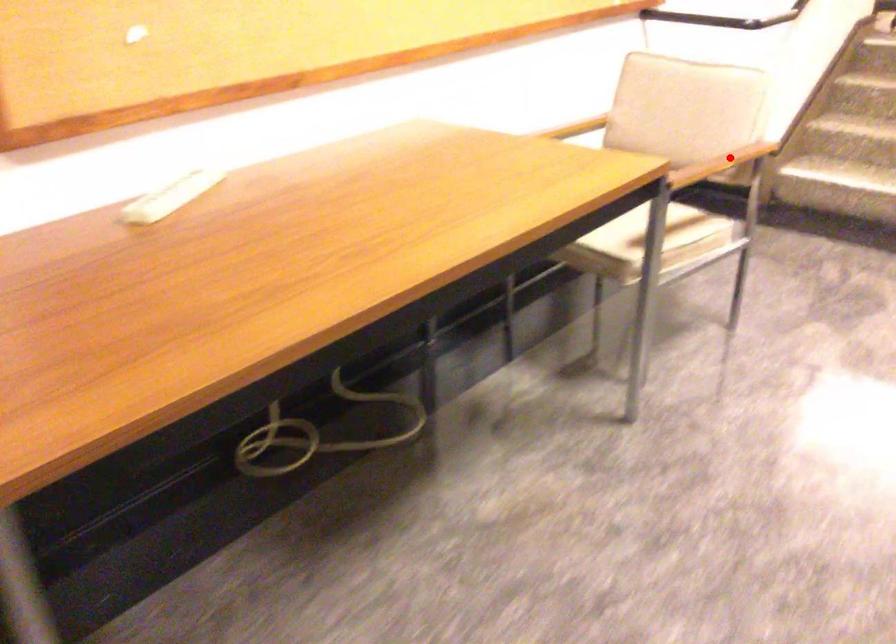
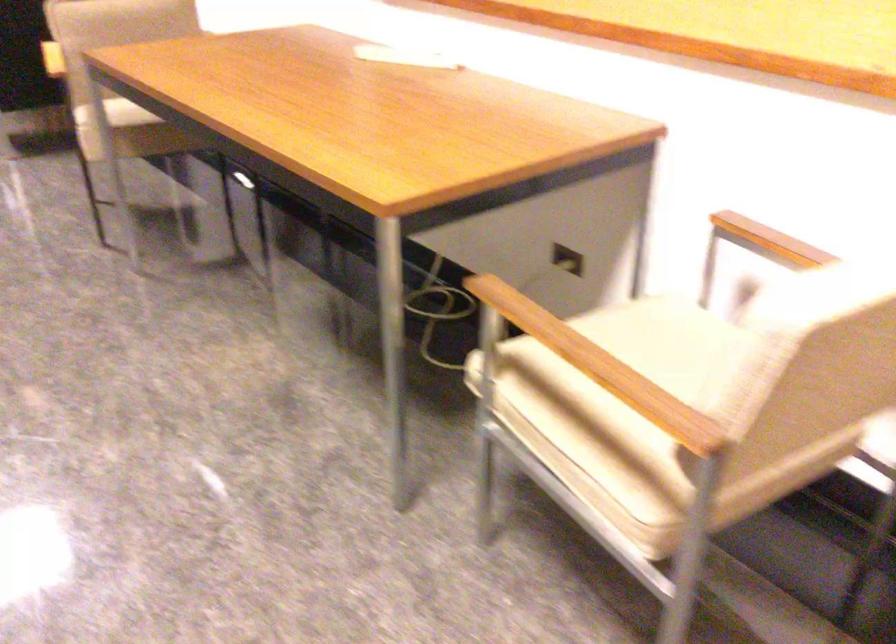
Find the pixel in the second image that matches the highlighted location in the first image.

(599, 366)